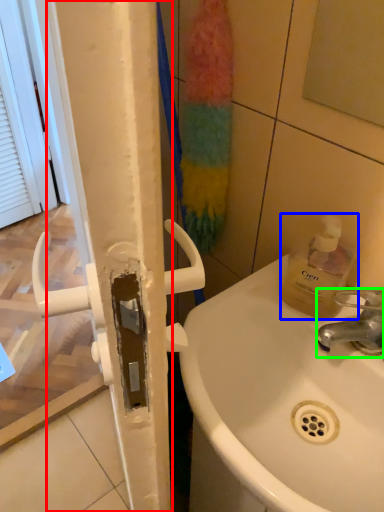
Question: Which object is positioned farthest from shower door (highlighted by a red box)? Select from bottle (highlighted by a blue box) and tap (highlighted by a green box).

Choices:
 (A) bottle
 (B) tap

Answer: (A)